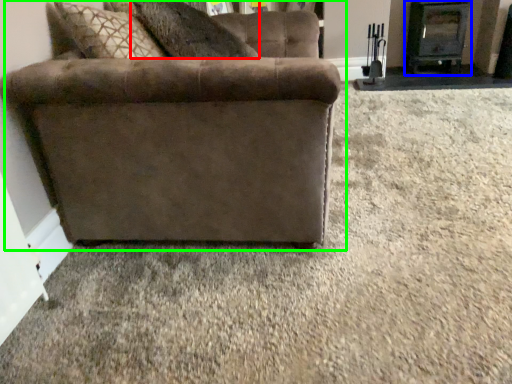
Question: Estimate the real-world distances between objects in this image. Which object is closer to pillow (highlighted by a red box), fireplace (highlighted by a blue box) or studio couch (highlighted by a green box)?

Choices:
 (A) fireplace
 (B) studio couch

Answer: (B)